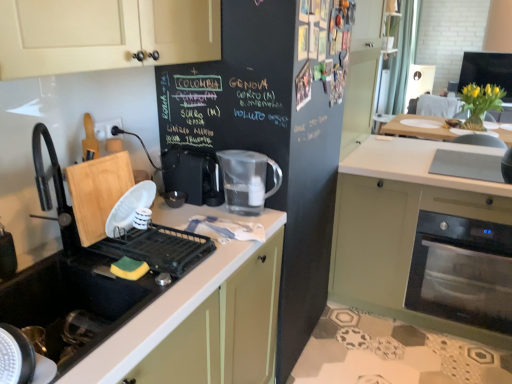
Find the location of `free space in front of black plastic coffee machine at center`. free space in front of black plastic coffee machine at center is located at coordinates (187, 216).